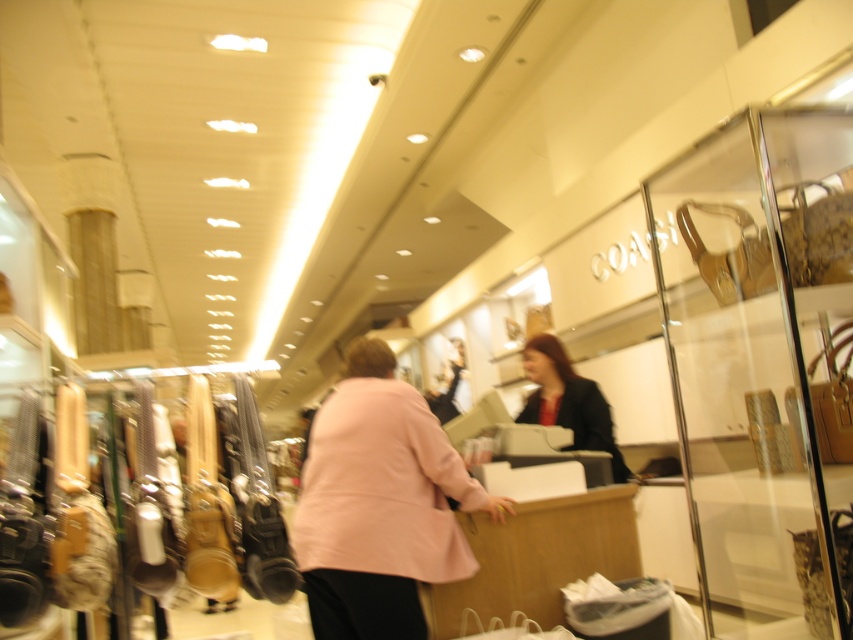
You are a customer in the store and want to try on the pink fabric coat at center and the dark blue fabric jacket at center. Which one is easier to reach without moving from your current position?

The pink fabric coat at center is closer to the viewer than the dark blue fabric jacket at center, so it is easier to reach without moving.

What is the color of the fabric at the point marked by the coordinates [379,504] in the image?

The point marked by the coordinates [379,504] corresponds to the pink fabric coat at center, so the color is pink.

You are standing at the point marked by the coordinate point at (x=300, y=532) in the image. You want to move to the checkout counter where the two people are interacting. Is there enough space between you and the checkout counter for you to walk comfortably? Please consider the distance provided in the description.

The two people at the checkout counter are 6.75 feet apart from the point marked by the coordinate point at (x=300, y=532). This distance is more than sufficient for comfortable movement, so yes, there is enough space to walk to the checkout counter.